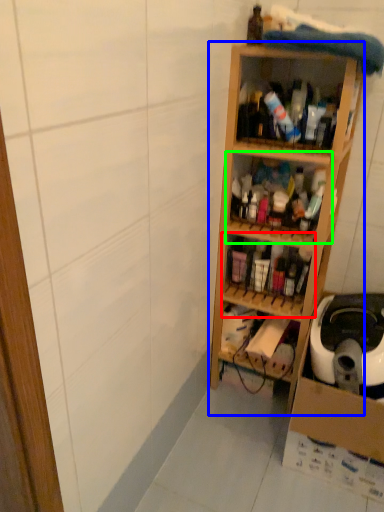
Question: Estimate the real-world distances between objects in this image. Which object is farther from shelf (highlighted by a red box), shelf (highlighted by a blue box) or shelf (highlighted by a green box)?

Choices:
 (A) shelf
 (B) shelf

Answer: (B)